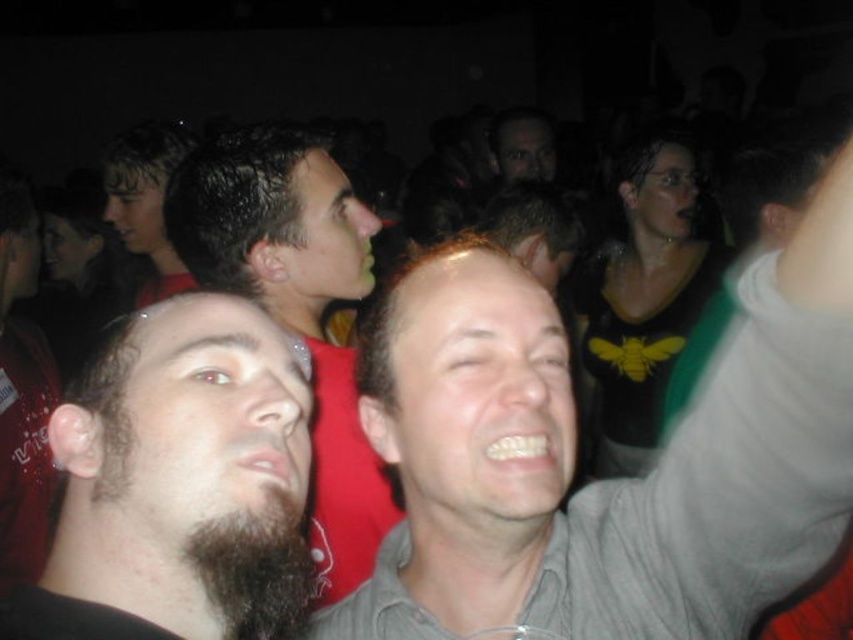
Question: Which of the following is the closest to the observer?

Choices:
 (A) (100, 432)
 (B) (363, 605)

Answer: (A)

Question: Among these objects, which one is farthest from the camera?

Choices:
 (A) dark brown beard at left
 (B) dark brown hair at upper left

Answer: (B)

Question: Does dark brown fuzzy beard at lower left have a larger size compared to dark brown hair at upper left?

Choices:
 (A) no
 (B) yes

Answer: (A)

Question: Which point appears farthest from the camera in this image?

Choices:
 (A) (682, 236)
 (B) (160, 276)
 (C) (376, 419)

Answer: (B)

Question: Does gray matte shirt at center appear on the left side of dark brown beard at left?

Choices:
 (A) yes
 (B) no

Answer: (B)

Question: Is gray matte shirt at center wider than dark brown fuzzy beard at lower left?

Choices:
 (A) yes
 (B) no

Answer: (A)